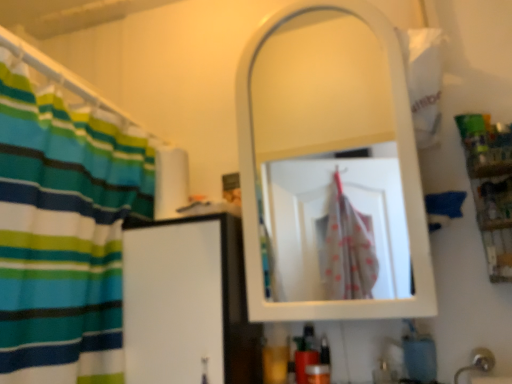
Describe the element at coordinates (419, 355) in the screenshot. I see `blue matte soap at lower right` at that location.

The width and height of the screenshot is (512, 384). In order to click on wooden shelf at right in this screenshot , I will do click(490, 187).

Consider the image. Can you confirm if blue matte soap at lower right is shorter than white glossy mirror at upper center?

Correct, blue matte soap at lower right is not as tall as white glossy mirror at upper center.

What's the angular difference between blue matte soap at lower right and white glossy mirror at upper center's facing directions?

The facing directions of blue matte soap at lower right and white glossy mirror at upper center are 0.989 degrees apart.

In the scene shown: From the image's perspective, which is above, blue matte soap at lower right or white glossy mirror at upper center?

From the image's view, white glossy mirror at upper center is above.

What are the coordinates of `mirror behind the silver metallic faucet at lower right` in the screenshot? It's located at (314, 115).

From a real-world perspective, between white glossy mirror at upper center and silver metallic faucet at lower right, who is vertically higher?

From a 3D spatial view, white glossy mirror at upper center is above.

Considering the relative sizes of white glossy mirror at upper center and silver metallic faucet at lower right in the image provided, is white glossy mirror at upper center thinner than silver metallic faucet at lower right?

Incorrect, the width of white glossy mirror at upper center is not less than that of silver metallic faucet at lower right.

Can you tell me how much white glossy mirror at upper center and silver metallic faucet at lower right differ in facing direction?

They differ by 0.989 degrees in their facing directions.

Is wooden shelf at right inside or outside of silver metallic faucet at lower right?

wooden shelf at right lies outside silver metallic faucet at lower right.

Can you confirm if wooden shelf at right is smaller than silver metallic faucet at lower right?

Yes, wooden shelf at right is smaller than silver metallic faucet at lower right.

Is wooden shelf at right positioned with its back to silver metallic faucet at lower right?

That's not correct — wooden shelf at right is not looking away from silver metallic faucet at lower right.

What's the angular difference between silver metallic faucet at lower right and blue matte soap at lower right's facing directions?

silver metallic faucet at lower right and blue matte soap at lower right are facing 0.000729 degrees away from each other.

Who is more distant, silver metallic faucet at lower right or blue matte soap at lower right?

blue matte soap at lower right.

Which is less distant, (481, 367) or (414, 371)?

Clearly, point (481, 367) is more distant from the camera than point (414, 371).

Would you say silver metallic faucet at lower right is inside or outside blue matte soap at lower right?

silver metallic faucet at lower right is outside blue matte soap at lower right.

Considering the positions of point (406, 343) and point (490, 173), is point (406, 343) closer or farther from the camera than point (490, 173)?

Point (406, 343) is positioned closer to the camera compared to point (490, 173).

Who is taller, blue matte soap at lower right or wooden shelf at right?

wooden shelf at right is taller.

Considering the positions of objects blue matte soap at lower right and wooden shelf at right in the image provided, who is more to the left, blue matte soap at lower right or wooden shelf at right?

Positioned to the left is blue matte soap at lower right.

Is blue matte soap at lower right further to the viewer compared to wooden shelf at right?

Yes, the depth of blue matte soap at lower right is greater than that of wooden shelf at right.

Are wooden shelf at right and white glossy mirror at upper center located far from each other?

Actually, wooden shelf at right and white glossy mirror at upper center are a little close together.

Is white glossy mirror at upper center at the back of wooden shelf at right?

No, wooden shelf at right's orientation is not away from white glossy mirror at upper center.

From the image's perspective, which one is positioned lower, wooden shelf at right or white glossy mirror at upper center?

wooden shelf at right appears lower in the image.

From a real-world perspective, between wooden shelf at right and white glossy mirror at upper center, who is vertically lower?

In real-world perspective, wooden shelf at right is lower.

From a real-world perspective, is white glossy mirror at upper center physically located above or below blue matte soap at lower right?

From a real-world perspective, white glossy mirror at upper center is physically above blue matte soap at lower right.

Which of these two, white glossy mirror at upper center or blue matte soap at lower right, is wider?

Wider between the two is white glossy mirror at upper center.

Is point (342, 25) more distant than point (425, 363)?

Yes, it is behind point (425, 363).

In terms of size, does white glossy mirror at upper center appear bigger or smaller than blue matte soap at lower right?

Considering their sizes, white glossy mirror at upper center takes up more space than blue matte soap at lower right.

You are a GUI agent. You are given a task and a screenshot of the screen. Output one action in this format:
    pyautogui.click(x=<x>, y=<y>)
    Task: Click on the mirror on the left side of blue matte soap at lower right
    The image size is (512, 384).
    Given the screenshot: What is the action you would take?
    pyautogui.click(x=314, y=115)

Locate an element on the screen. faucet on the right of white glossy mirror at upper center is located at coordinates (478, 362).

In the scene shown: Based on their spatial positions, is wooden shelf at right or blue matte soap at lower right closer to white glossy mirror at upper center?

The object closer to white glossy mirror at upper center is wooden shelf at right.

Based on their spatial positions, is wooden shelf at right or white glossy mirror at upper center further from silver metallic faucet at lower right?

white glossy mirror at upper center lies further to silver metallic faucet at lower right than the other object.

Which object lies nearer to the anchor point white glossy mirror at upper center, blue matte soap at lower right or wooden shelf at right?

Among the two, wooden shelf at right is located nearer to white glossy mirror at upper center.

In the scene shown: Looking at the image, which one is located closer to silver metallic faucet at lower right, white glossy mirror at upper center or wooden shelf at right?

wooden shelf at right.

Estimate the real-world distances between objects in this image. Which object is closer to white glossy mirror at upper center, blue matte soap at lower right or silver metallic faucet at lower right?

The object closer to white glossy mirror at upper center is blue matte soap at lower right.

Which object lies nearer to the anchor point white glossy mirror at upper center, wooden shelf at right or silver metallic faucet at lower right?

wooden shelf at right.

Considering their positions, is white glossy mirror at upper center positioned closer to blue matte soap at lower right than wooden shelf at right?

The object closer to blue matte soap at lower right is wooden shelf at right.

Based on the photo, from the image, which object appears to be nearer to wooden shelf at right, blue matte soap at lower right or silver metallic faucet at lower right?

blue matte soap at lower right is closer to wooden shelf at right.

In order to click on shelf between white glossy mirror at upper center and silver metallic faucet at lower right vertically in this screenshot , I will do `click(490, 187)`.

Where is `soap that lies between wooden shelf at right and silver metallic faucet at lower right from top to bottom`? The width and height of the screenshot is (512, 384). soap that lies between wooden shelf at right and silver metallic faucet at lower right from top to bottom is located at coordinates coord(419,355).

This screenshot has width=512, height=384. Find the location of `soap between white glossy mirror at upper center and silver metallic faucet at lower right in the vertical direction`. soap between white glossy mirror at upper center and silver metallic faucet at lower right in the vertical direction is located at coordinates (419, 355).

Locate an element on the screen. The width and height of the screenshot is (512, 384). shelf between white glossy mirror at upper center and blue matte soap at lower right in the up-down direction is located at coordinates (490, 187).